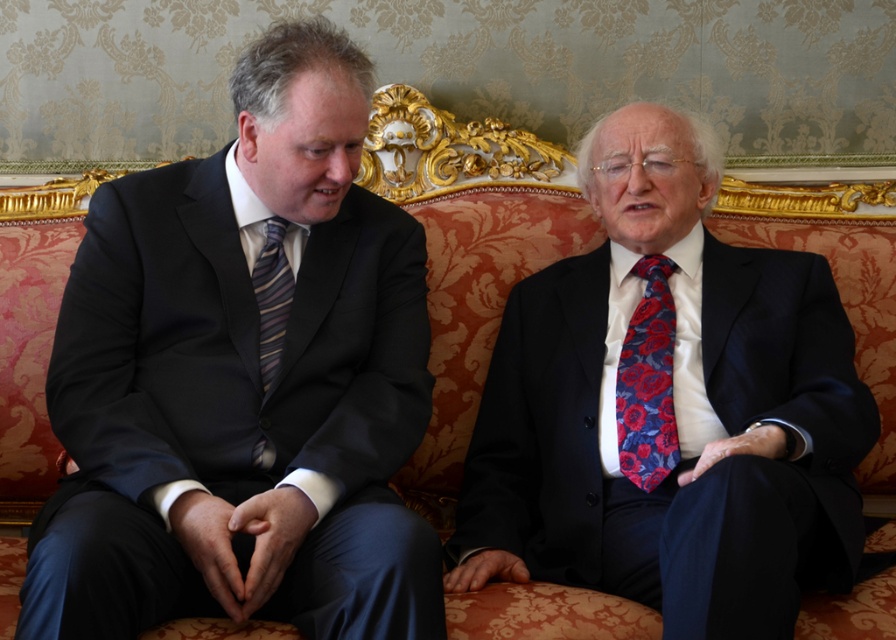
You are a tailor observing two individuals in a formal setting. You notice the matte black suit at left and the matte black suit at center. Which of these two suits has a wider torso measurement?

The matte black suit at center has a wider torso measurement since it is thicker than the matte black suit at left.

You are standing in front of the sofa and want to place a small decorative item exactly at the point marked by coordinates point (242, 381). Which object from the scene will this item be placed on?

The point (242, 381) marks the matte black suit at left, so the decorative item will be placed on the matte black suit at left.